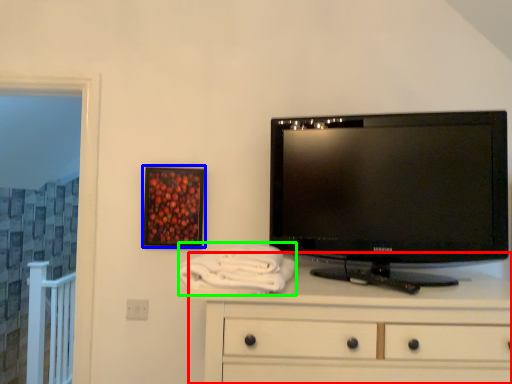
Question: Which object is positioned farthest from chest of drawers (highlighted by a red box)? Select from picture frame (highlighted by a blue box) and bath towel (highlighted by a green box).

Choices:
 (A) picture frame
 (B) bath towel

Answer: (A)